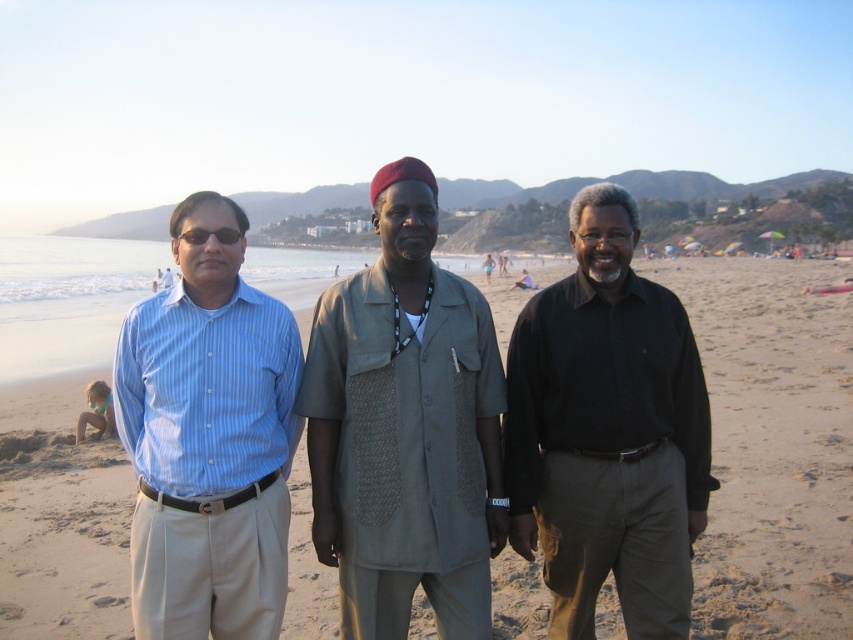
Question: Considering the real-world distances, which object is closest to the blue striped shirt at left?

Choices:
 (A) black matte shirt at center
 (B) beige sand at center
 (C) khaki textured shirt at center

Answer: (C)

Question: Which of the following is the farthest from the observer?

Choices:
 (A) (404, 483)
 (B) (207, 618)
 (C) (599, 340)

Answer: (C)

Question: Which object is the closest to the black matte shirt at center?

Choices:
 (A) beige sand at center
 (B) blue striped shirt at left

Answer: (B)

Question: Where is khaki textured shirt at center located in relation to black matte shirt at center in the image?

Choices:
 (A) left
 (B) right

Answer: (A)

Question: Considering the relative positions of khaki textured shirt at center and black matte shirt at center in the image provided, where is khaki textured shirt at center located with respect to black matte shirt at center?

Choices:
 (A) below
 (B) above

Answer: (A)

Question: Is beige sand at center bigger than black matte shirt at center?

Choices:
 (A) no
 (B) yes

Answer: (B)